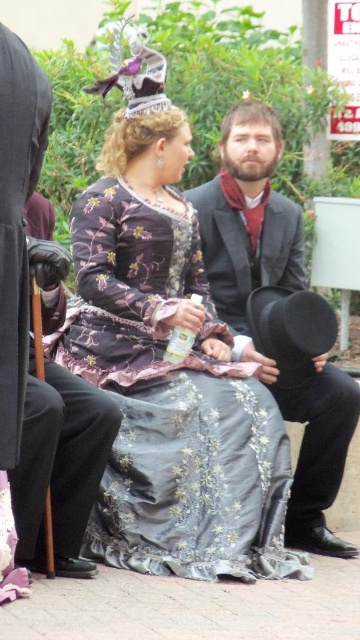
Question: Which object appears farthest from the camera in this image?

Choices:
 (A) matte black suit at center
 (B) silky purple dress at center

Answer: (A)

Question: Can you confirm if silky purple dress at center is positioned above matte black suit at center?

Choices:
 (A) no
 (B) yes

Answer: (A)

Question: Does silky purple dress at center have a smaller size compared to matte black suit at center?

Choices:
 (A) yes
 (B) no

Answer: (B)

Question: Is silky purple dress at center above matte black suit at center?

Choices:
 (A) yes
 (B) no

Answer: (B)